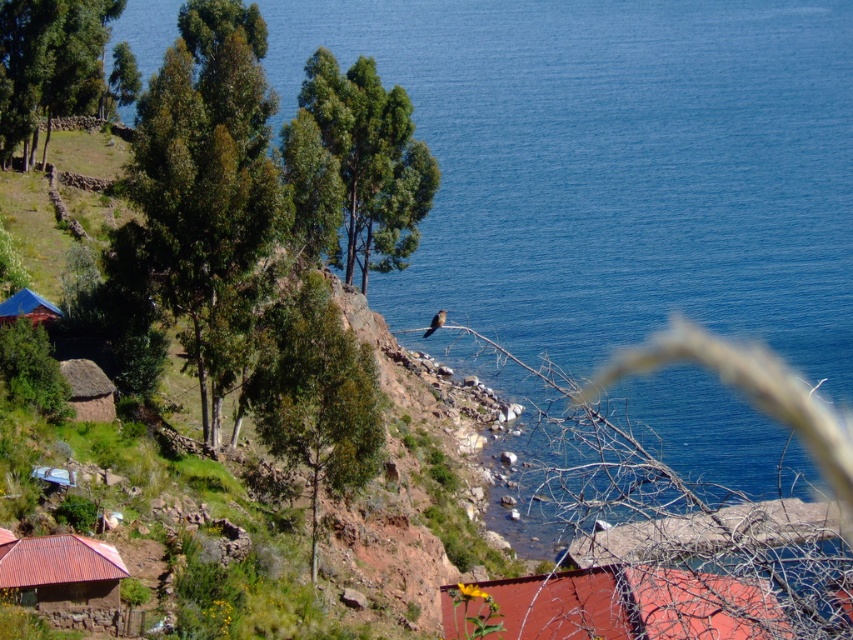
Does green grassy hillside at lower left have a lesser width compared to green leafy tree at upper center?

No.

Based on the photo, who is more distant from viewer, (496, 410) or (341, 168)?

Positioned behind is point (496, 410).

Find the location of a particular element. This screenshot has width=853, height=640. green grassy hillside at lower left is located at coordinates 430,435.

Is green leafy tree at upper left wider than thatched brown hut at lower left?

Yes.

Measure the distance between point [28,163] and camera.

Point [28,163] is 94.40 meters from camera.

Where is `green leafy tree at upper left`? The image size is (853, 640). green leafy tree at upper left is located at coordinates (48, 64).

This screenshot has width=853, height=640. Identify the location of green leafy tree at upper left. (48, 64).

Is green grassy hillside at lower left below red corrugated metal roof at lower center?

No.

Is green grassy hillside at lower left to the right of red corrugated metal roof at lower center from the viewer's perspective?

No, green grassy hillside at lower left is not to the right of red corrugated metal roof at lower center.

Which is behind, point (341, 310) or point (538, 612)?

Point (341, 310)

The width and height of the screenshot is (853, 640). Identify the location of green grassy hillside at lower left. (430, 435).